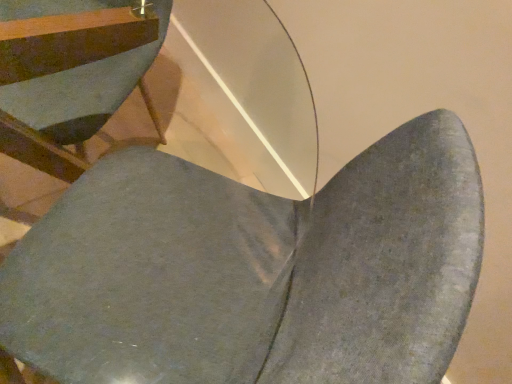
Question: Considering the relative sizes of matte gray chair at lower left, arranged as the second chair when viewed from the right, and matte gray chair at center, which is the first chair in right-to-left order, in the image provided, is matte gray chair at lower left, arranged as the second chair when viewed from the right, taller than matte gray chair at center, which is the first chair in right-to-left order,?

Choices:
 (A) no
 (B) yes

Answer: (A)

Question: Is matte gray chair at lower left, the first chair positioned from the left, thinner than matte gray chair at center, marked as the second chair in a left-to-right arrangement?

Choices:
 (A) yes
 (B) no

Answer: (B)

Question: Is matte gray chair at lower left, the first chair positioned from the left, completely or partially outside of matte gray chair at center, marked as the second chair in a left-to-right arrangement?

Choices:
 (A) yes
 (B) no

Answer: (A)

Question: Is matte gray chair at lower left, the first chair positioned from the left, not near matte gray chair at center, which is the first chair in right-to-left order?

Choices:
 (A) no
 (B) yes

Answer: (A)

Question: Does matte gray chair at lower left, the first chair positioned from the left, appear on the right side of matte gray chair at center, which is the first chair in right-to-left order?

Choices:
 (A) no
 (B) yes

Answer: (A)

Question: Is matte gray chair at center, which is the first chair in right-to-left order, inside matte gray chair at lower left, arranged as the second chair when viewed from the right?

Choices:
 (A) no
 (B) yes

Answer: (A)

Question: Is matte gray chair at center, marked as the second chair in a left-to-right arrangement, closer to camera compared to matte gray chair at lower left, arranged as the second chair when viewed from the right?

Choices:
 (A) no
 (B) yes

Answer: (B)

Question: Is matte gray chair at center, marked as the second chair in a left-to-right arrangement, next to matte gray chair at lower left, arranged as the second chair when viewed from the right, and touching it?

Choices:
 (A) yes
 (B) no

Answer: (B)

Question: Is matte gray chair at lower left, the first chair positioned from the left, a part of matte gray chair at center, which is the first chair in right-to-left order?

Choices:
 (A) yes
 (B) no

Answer: (B)

Question: Is matte gray chair at lower left, arranged as the second chair when viewed from the right, at the back of matte gray chair at center, marked as the second chair in a left-to-right arrangement?

Choices:
 (A) no
 (B) yes

Answer: (A)

Question: Are matte gray chair at center, marked as the second chair in a left-to-right arrangement, and matte gray chair at lower left, the first chair positioned from the left, located far from each other?

Choices:
 (A) no
 (B) yes

Answer: (A)

Question: Can you confirm if matte gray chair at center, marked as the second chair in a left-to-right arrangement, is smaller than matte gray chair at lower left, arranged as the second chair when viewed from the right?

Choices:
 (A) no
 (B) yes

Answer: (A)

Question: Considering the relative positions of matte gray chair at lower left, the first chair positioned from the left, and matte gray chair at center, which is the first chair in right-to-left order, in the image provided, is matte gray chair at lower left, the first chair positioned from the left, to the left or to the right of matte gray chair at center, which is the first chair in right-to-left order,?

Choices:
 (A) right
 (B) left

Answer: (B)